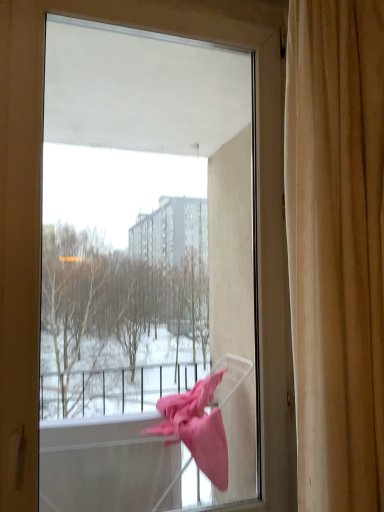
Where is `beige fabric curtain at right`? beige fabric curtain at right is located at coordinates (336, 248).

The width and height of the screenshot is (384, 512). Describe the element at coordinates (336, 248) in the screenshot. I see `beige fabric curtain at right` at that location.

What do you see at coordinates (257, 207) in the screenshot? I see `transparent plastic basket at lower right` at bounding box center [257, 207].

The width and height of the screenshot is (384, 512). Identify the location of transparent plastic basket at lower right. (257, 207).

In order to click on beige fabric curtain at right in this screenshot , I will do `click(336, 248)`.

Can you confirm if transparent plastic basket at lower right is positioned to the right of beige fabric curtain at right?

Incorrect, transparent plastic basket at lower right is not on the right side of beige fabric curtain at right.

Is transparent plastic basket at lower right in front of or behind beige fabric curtain at right in the image?

transparent plastic basket at lower right is positioned farther from the viewer than beige fabric curtain at right.

Does point (277, 351) appear closer or farther from the camera than point (383, 183)?

Point (277, 351).

From the image's perspective, is transparent plastic basket at lower right above or below beige fabric curtain at right?

From the image's perspective, transparent plastic basket at lower right appears below beige fabric curtain at right.

From a real-world perspective, does transparent plastic basket at lower right sit lower than beige fabric curtain at right?

Yes, from a real-world perspective, transparent plastic basket at lower right is below beige fabric curtain at right.

Considering the sizes of objects transparent plastic basket at lower right and beige fabric curtain at right in the image provided, who is wider, transparent plastic basket at lower right or beige fabric curtain at right?

beige fabric curtain at right.

Can you confirm if transparent plastic basket at lower right is taller than beige fabric curtain at right?

Indeed, transparent plastic basket at lower right has a greater height compared to beige fabric curtain at right.

Who is bigger, transparent plastic basket at lower right or beige fabric curtain at right?

With larger size is transparent plastic basket at lower right.

Would you say beige fabric curtain at right is part of transparent plastic basket at lower right's contents?

Definitely not — beige fabric curtain at right is not inside transparent plastic basket at lower right.

Based on the photo, is transparent plastic basket at lower right in contact with beige fabric curtain at right?

No, transparent plastic basket at lower right is not touching beige fabric curtain at right.

Is transparent plastic basket at lower right turned away from beige fabric curtain at right?

No, transparent plastic basket at lower right is not facing away from beige fabric curtain at right.

How far apart are transparent plastic basket at lower right and beige fabric curtain at right?

transparent plastic basket at lower right and beige fabric curtain at right are 11.84 inches apart.

The height and width of the screenshot is (512, 384). In order to click on window behind the beige fabric curtain at right in this screenshot , I will do `click(257, 207)`.

Considering the positions of objects beige fabric curtain at right and transparent plastic basket at lower right in the image provided, who is more to the left, beige fabric curtain at right or transparent plastic basket at lower right?

transparent plastic basket at lower right.

Considering the positions of objects beige fabric curtain at right and transparent plastic basket at lower right in the image provided, who is behind, beige fabric curtain at right or transparent plastic basket at lower right?

transparent plastic basket at lower right is further away from the camera.

Between point (377, 431) and point (283, 185), which one is positioned behind?

Point (283, 185)

From the image's perspective, is beige fabric curtain at right located beneath transparent plastic basket at lower right?

Actually, beige fabric curtain at right appears above transparent plastic basket at lower right in the image.

From a real-world perspective, who is located lower, beige fabric curtain at right or transparent plastic basket at lower right?

transparent plastic basket at lower right, from a real-world perspective.

In terms of width, does beige fabric curtain at right look wider or thinner when compared to transparent plastic basket at lower right?

In the image, beige fabric curtain at right appears to be wider than transparent plastic basket at lower right.

Does beige fabric curtain at right have a lesser height compared to transparent plastic basket at lower right?

Yes, beige fabric curtain at right is shorter than transparent plastic basket at lower right.

Based on their sizes in the image, would you say beige fabric curtain at right is bigger or smaller than transparent plastic basket at lower right?

beige fabric curtain at right is smaller than transparent plastic basket at lower right.

Is beige fabric curtain at right surrounding transparent plastic basket at lower right?

No.

Is beige fabric curtain at right far away from transparent plastic basket at lower right?

They are positioned close to each other.

Consider the image. Is beige fabric curtain at right positioned with its back to transparent plastic basket at lower right?

Yes, beige fabric curtain at right is facing away from transparent plastic basket at lower right.

What's the angular difference between beige fabric curtain at right and transparent plastic basket at lower right's facing directions?

They differ by 0.318 degrees in their facing directions.

What are the coordinates of `window on the left of beige fabric curtain at right` in the screenshot? It's located at (257, 207).

I want to click on window below the beige fabric curtain at right (from the image's perspective), so click(257, 207).

Identify the location of window directly beneath the beige fabric curtain at right (from a real-world perspective). (257, 207).